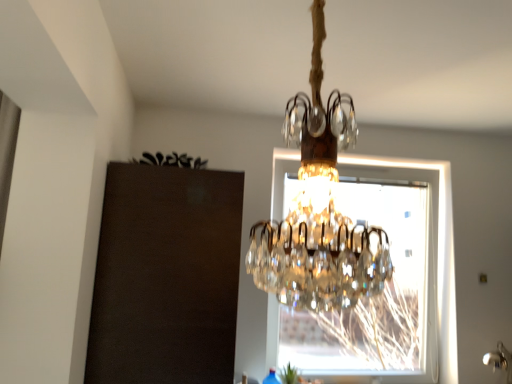
Where is `green leafy plant at lower center`? This screenshot has width=512, height=384. green leafy plant at lower center is located at coordinates (290, 375).

What is the approximate width of green leafy plant at lower center?

green leafy plant at lower center is 12.20 centimeters in width.

Describe the element at coordinates (290, 375) in the screenshot. I see `green leafy plant at lower center` at that location.

At what (x,y) coordinates should I click in order to perform the action: click on transparent glass window at center. Please return your answer as a coordinate pair (x, y). The width and height of the screenshot is (512, 384). Looking at the image, I should click on (436, 244).

The height and width of the screenshot is (384, 512). What do you see at coordinates (436, 244) in the screenshot? I see `transparent glass window at center` at bounding box center [436, 244].

You are a GUI agent. You are given a task and a screenshot of the screen. Output one action in this format:
    pyautogui.click(x=<x>, y=<y>)
    Task: Click on the green leafy plant at lower center
    This screenshot has height=384, width=512.
    Given the screenshot: What is the action you would take?
    pyautogui.click(x=290, y=375)

Considering the positions of objects green leafy plant at lower center and transparent glass window at center in the image provided, who is more to the right, green leafy plant at lower center or transparent glass window at center?

transparent glass window at center is more to the right.

Is green leafy plant at lower center positioned behind transparent glass window at center?

No, green leafy plant at lower center is closer to the viewer.

Is point (281, 372) positioned before point (274, 166)?

Yes, point (281, 372) is in front of point (274, 166).

From the image's perspective, is green leafy plant at lower center located above transparent glass window at center?

Incorrect, from the image's perspective, green leafy plant at lower center is lower than transparent glass window at center.

In the scene shown: From a real-world perspective, which object rests below the other?

In real-world perspective, green leafy plant at lower center is lower.

Is green leafy plant at lower center wider than transparent glass window at center?

Incorrect, the width of green leafy plant at lower center does not surpass that of transparent glass window at center.

Considering the relative sizes of green leafy plant at lower center and transparent glass window at center in the image provided, is green leafy plant at lower center taller than transparent glass window at center?

Incorrect, the height of green leafy plant at lower center is not larger of that of transparent glass window at center.

Who is smaller, green leafy plant at lower center or transparent glass window at center?

With smaller size is green leafy plant at lower center.

Is green leafy plant at lower center completely or partially outside of transparent glass window at center?

That's correct, green leafy plant at lower center is outside of transparent glass window at center.

Is green leafy plant at lower center not near transparent glass window at center?

Yes, green leafy plant at lower center and transparent glass window at center are located far from each other.

Is green leafy plant at lower center turned away from transparent glass window at center?

No, green leafy plant at lower center's orientation is not away from transparent glass window at center.

How many degrees apart are the facing directions of green leafy plant at lower center and transparent glass window at center?

24.5 degrees.

How much distance is there between green leafy plant at lower center and transparent glass window at center?

green leafy plant at lower center and transparent glass window at center are 1.17 meters apart.

Where is `window that is above the green leafy plant at lower center (from the image's perspective)`? This screenshot has width=512, height=384. window that is above the green leafy plant at lower center (from the image's perspective) is located at coordinates (436, 244).

In the scene shown: Between transparent glass window at center and green leafy plant at lower center, which one appears on the right side from the viewer's perspective?

transparent glass window at center.

Is the depth of transparent glass window at center greater than that of green leafy plant at lower center?

Yes, transparent glass window at center is behind green leafy plant at lower center.

Does point (273, 340) lie behind point (285, 369)?

Yes, it is behind point (285, 369).

From the image's perspective, which is below, transparent glass window at center or green leafy plant at lower center?

green leafy plant at lower center appears lower in the image.

From a real-world perspective, is transparent glass window at center positioned over green leafy plant at lower center based on gravity?

Yes.

Does transparent glass window at center have a lesser width compared to green leafy plant at lower center?

No.

Considering the relative sizes of transparent glass window at center and green leafy plant at lower center in the image provided, is transparent glass window at center shorter than green leafy plant at lower center?

In fact, transparent glass window at center may be taller than green leafy plant at lower center.

Considering the sizes of objects transparent glass window at center and green leafy plant at lower center in the image provided, who is bigger, transparent glass window at center or green leafy plant at lower center?

transparent glass window at center.

Is transparent glass window at center not within green leafy plant at lower center?

Yes, transparent glass window at center is located beyond the bounds of green leafy plant at lower center.

Is transparent glass window at center touching green leafy plant at lower center?

No.

Does transparent glass window at center turn towards green leafy plant at lower center?

Yes, transparent glass window at center is aimed at green leafy plant at lower center.

Find the location of `window on the right of green leafy plant at lower center`. window on the right of green leafy plant at lower center is located at coordinates (436, 244).

Where is `plant located below the transparent glass window at center (from the image's perspective)`? plant located below the transparent glass window at center (from the image's perspective) is located at coordinates (290, 375).

The width and height of the screenshot is (512, 384). Identify the location of window above the green leafy plant at lower center (from a real-world perspective). (436, 244).